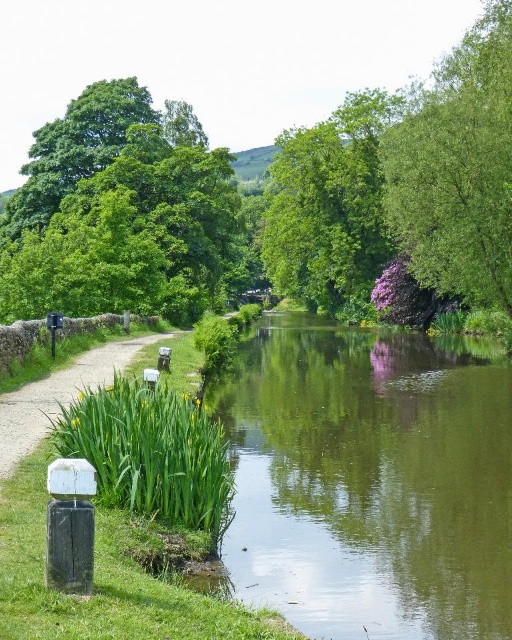
Question: Which object appears farthest from the camera in this image?

Choices:
 (A) white concrete path at lower left
 (B) green leafy tree at right
 (C) green leafy tree at upper left
 (D) green leafy tree at upper center

Answer: (D)

Question: Considering the real-world distances, which object is closest to the green leafy tree at upper left?

Choices:
 (A) green leafy tree at right
 (B) green leafy tree at upper center

Answer: (B)

Question: Observing the image, what is the correct spatial positioning of green leafy tree at upper left in reference to white concrete path at lower left?

Choices:
 (A) above
 (B) below

Answer: (A)

Question: Considering the relative positions of green leafy tree at upper center and white concrete path at lower left in the image provided, where is green leafy tree at upper center located with respect to white concrete path at lower left?

Choices:
 (A) below
 (B) above

Answer: (B)

Question: Can you confirm if green smooth water at center is wider than white concrete path at lower left?

Choices:
 (A) no
 (B) yes

Answer: (B)

Question: Which point is closer to the camera?

Choices:
 (A) green leafy tree at right
 (B) green smooth water at center

Answer: (B)